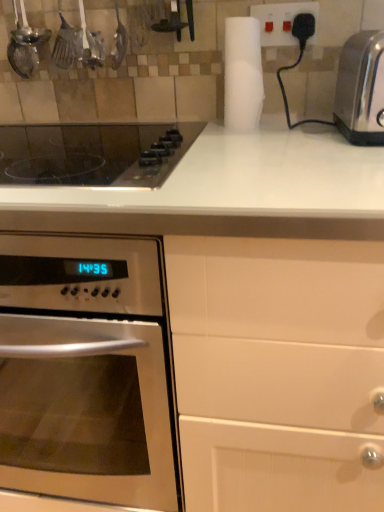
Describe the element at coordinates (93, 153) in the screenshot. I see `black glass cooktop at upper left` at that location.

What is the approximate width of white plastic plug at upper right?

white plastic plug at upper right is 0.68 inches in width.

What is the approximate height of satin silver oven at left?

The height of satin silver oven at left is 35.61 inches.

The image size is (384, 512). What are the coordinates of `satin silver toaster at right` in the screenshot? It's located at (361, 89).

From the image's perspective, which is below, satin silver toaster at right or white matte paper towel at upper center?

satin silver toaster at right is shown below in the image.

Does satin silver toaster at right have a lesser width compared to white matte paper towel at upper center?

No, satin silver toaster at right is not thinner than white matte paper towel at upper center.

Which of these two, satin silver toaster at right or white matte paper towel at upper center, stands taller?

white matte paper towel at upper center.

Which is more distant, (377, 98) or (244, 20)?

The point (244, 20) is farther from the camera.

In the scene shown: Between white matte paper towel at upper center and black glass cooktop at upper left, which one appears on the right side from the viewer's perspective?

Positioned to the right is white matte paper towel at upper center.

Which is correct: white matte paper towel at upper center is inside black glass cooktop at upper left, or outside of it?

white matte paper towel at upper center lies outside black glass cooktop at upper left.

I want to click on paper towel located on the right of black glass cooktop at upper left, so pyautogui.click(x=243, y=74).

Does white plastic plug at upper right have a smaller size compared to white matte paper towel at upper center?

Yes, white plastic plug at upper right is smaller than white matte paper towel at upper center.

Could you tell me if white plastic plug at upper right is facing white matte paper towel at upper center?

No, white plastic plug at upper right is not oriented towards white matte paper towel at upper center.

Locate an element on the screen. electric outlet above the white matte paper towel at upper center (from the image's perspective) is located at coordinates (281, 21).

Which object is closer to the camera, white plastic plug at upper right or white matte paper towel at upper center?

white matte paper towel at upper center is in front.

From a real-world perspective, is satin silver toaster at right physically located above or below black glass cooktop at upper left?

In terms of real-world spatial position, satin silver toaster at right is above black glass cooktop at upper left.

Is point (365, 48) closer to camera compared to point (46, 176)?

Yes, it is in front of point (46, 176).

Is black glass cooktop at upper left inside satin silver toaster at right?

No, black glass cooktop at upper left is not inside satin silver toaster at right.

At what (x,y) coordinates should I click in order to perform the action: click on toaster that is on the right side of black glass cooktop at upper left. Please return your answer as a coordinate pair (x, y). This screenshot has width=384, height=512. Looking at the image, I should click on (361, 89).

Is white plastic plug at upper right thinner than black glass cooktop at upper left?

Yes, white plastic plug at upper right is thinner than black glass cooktop at upper left.

Identify the location of gas stove that is in front of the white plastic plug at upper right. This screenshot has width=384, height=512. (93, 153).

Is white plastic plug at upper right with black glass cooktop at upper left?

No, white plastic plug at upper right is not with black glass cooktop at upper left.

Could black glass cooktop at upper left be considered to be inside white plastic plug at upper right?

No.

Is satin silver toaster at right oriented away from white plastic plug at upper right?

No, satin silver toaster at right is not facing away from white plastic plug at upper right.

Considering the relative positions of satin silver toaster at right and white plastic plug at upper right in the image provided, is satin silver toaster at right to the left or to the right of white plastic plug at upper right?

From the image, it's evident that satin silver toaster at right is to the right of white plastic plug at upper right.

From a real-world perspective, is satin silver toaster at right physically above white plastic plug at upper right?

Incorrect, from a real-world perspective, satin silver toaster at right is lower than white plastic plug at upper right.

Consider the image. Considering the relative sizes of satin silver toaster at right and white plastic plug at upper right in the image provided, is satin silver toaster at right thinner than white plastic plug at upper right?

In fact, satin silver toaster at right might be wider than white plastic plug at upper right.

Consider the image. How much distance is there between black glass cooktop at upper left and white plastic plug at upper right?

black glass cooktop at upper left and white plastic plug at upper right are 18.31 inches apart from each other.

The image size is (384, 512). Identify the location of electric outlet above the black glass cooktop at upper left (from the image's perspective). (281, 21).

Is black glass cooktop at upper left looking in the opposite direction of white plastic plug at upper right?

No, black glass cooktop at upper left is not facing away from white plastic plug at upper right.

The width and height of the screenshot is (384, 512). Find the location of `paper towel located behind the satin silver toaster at right`. paper towel located behind the satin silver toaster at right is located at coordinates (243, 74).

Identify the location of gas stove in front of the white matte paper towel at upper center. (93, 153).

From the image, which object appears to be farther from black glass cooktop at upper left, white plastic plug at upper right or satin silver oven at left?

Among the two, satin silver oven at left is located further to black glass cooktop at upper left.

Which object lies nearer to the anchor point satin silver oven at left, white plastic plug at upper right or satin silver toaster at right?

satin silver toaster at right is positioned closer to the anchor satin silver oven at left.

Based on the photo, estimate the real-world distances between objects in this image. Which object is closer to white plastic plug at upper right, black glass cooktop at upper left or white matte paper towel at upper center?

white matte paper towel at upper center is closer to white plastic plug at upper right.

From the image, which object appears to be nearer to white plastic plug at upper right, white matte paper towel at upper center or satin silver toaster at right?

Among the two, white matte paper towel at upper center is located nearer to white plastic plug at upper right.

From the image, which object appears to be farther from white plastic plug at upper right, satin silver oven at left or white matte paper towel at upper center?

The object further to white plastic plug at upper right is satin silver oven at left.

Estimate the real-world distances between objects in this image. Which object is closer to black glass cooktop at upper left, white plastic plug at upper right or white matte paper towel at upper center?

Based on the image, white matte paper towel at upper center appears to be nearer to black glass cooktop at upper left.

Consider the image. From the image, which object appears to be nearer to black glass cooktop at upper left, white matte paper towel at upper center or satin silver toaster at right?

Among the two, white matte paper towel at upper center is located nearer to black glass cooktop at upper left.

Which object lies nearer to the anchor point satin silver oven at left, white matte paper towel at upper center or white plastic plug at upper right?

The object closer to satin silver oven at left is white matte paper towel at upper center.

Find the location of `paper towel located between satin silver toaster at right and white plastic plug at upper right in the depth direction`. paper towel located between satin silver toaster at right and white plastic plug at upper right in the depth direction is located at coordinates (243, 74).

You are a GUI agent. You are given a task and a screenshot of the screen. Output one action in this format:
    pyautogui.click(x=<x>, y=<y>)
    Task: Click on the electric outlet between black glass cooktop at upper left and satin silver toaster at right from left to right
    Image resolution: width=384 pixels, height=512 pixels.
    Given the screenshot: What is the action you would take?
    pyautogui.click(x=281, y=21)

At what (x,y) coordinates should I click in order to perform the action: click on gas stove between satin silver oven at left and satin silver toaster at right in the horizontal direction. Please return your answer as a coordinate pair (x, y). The width and height of the screenshot is (384, 512). Looking at the image, I should click on (93, 153).

Locate an element on the screen. The image size is (384, 512). paper towel between black glass cooktop at upper left and satin silver toaster at right is located at coordinates (243, 74).